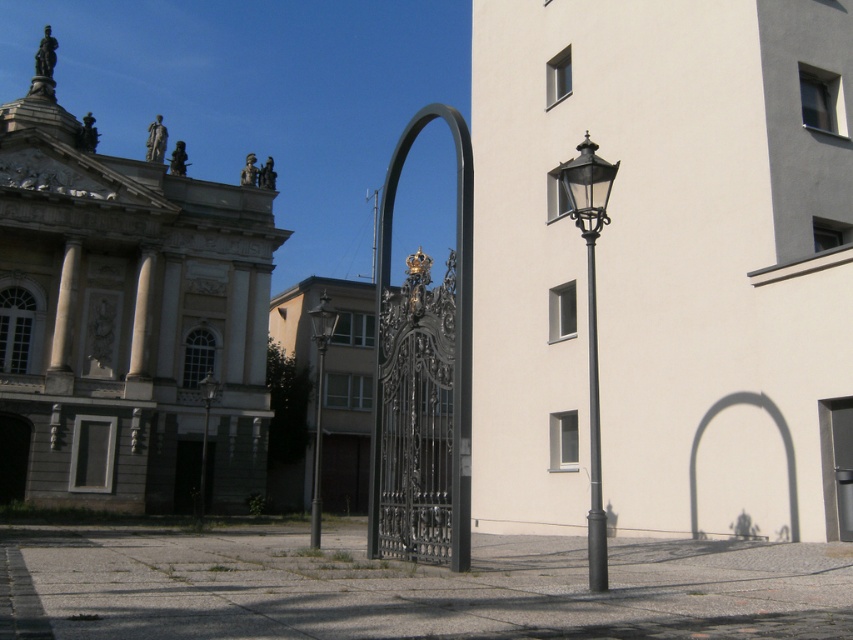
Based on the photo, is smooth black pole at center positioned at the back of matte black streetlight at center?

No, it is not.

Does smooth black pole at center appear on the right side of matte black streetlight at center?

Correct, you'll find smooth black pole at center to the right of matte black streetlight at center.

Is point (316, 500) positioned after point (210, 376)?

No, it is not.

Where is `smooth black pole at center`? Image resolution: width=853 pixels, height=640 pixels. smooth black pole at center is located at coordinates (317, 451).

Who is higher up, matte black street light at right or smooth black pole at center?

matte black street light at right

Does matte black street light at right have a lesser height compared to smooth black pole at center?

No, matte black street light at right is not shorter than smooth black pole at center.

Does point (589, 548) lie in front of point (312, 522)?

Yes, point (589, 548) is closer to viewer.

What are the coordinates of `matte black street light at right` in the screenshot? It's located at (590, 324).

Can you confirm if matte gray door at lower left is shorter than matte black streetlight at center?

Yes, matte gray door at lower left is shorter than matte black streetlight at center.

Measure the distance between point [74,483] and camera.

The distance of point [74,483] from camera is 38.07 meters.

Who is more distant from viewer, (103, 445) or (204, 436)?

The point (103, 445) is behind.

At what (x,y) coordinates should I click in order to perform the action: click on matte gray door at lower left. Please return your answer as a coordinate pair (x, y). This screenshot has height=640, width=853. Looking at the image, I should click on (91, 452).